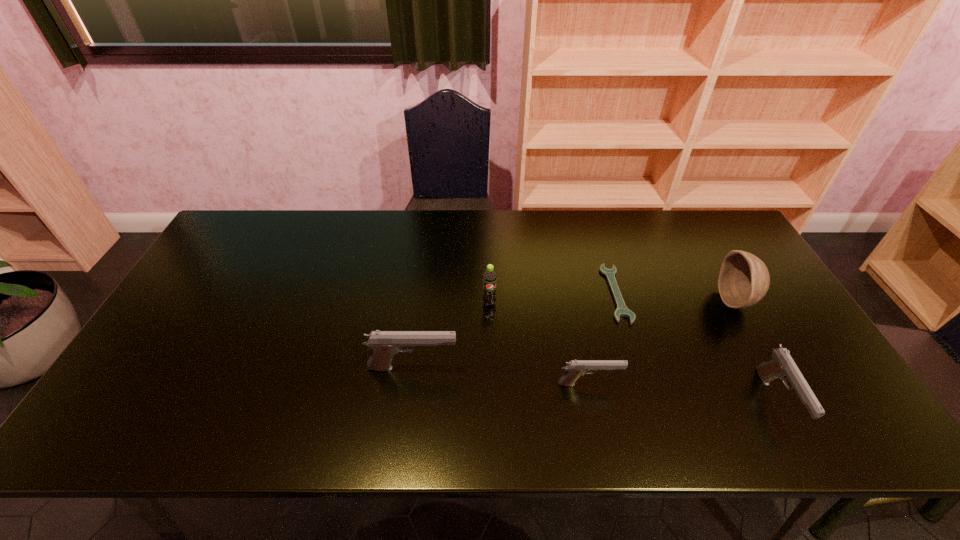
This screenshot has width=960, height=540. Find the location of `free region at the far right corner of the desktop`. free region at the far right corner of the desktop is located at coordinates (705, 224).

Locate an element on the screen. Image resolution: width=960 pixels, height=540 pixels. free space between the second shortest pistol and the leftmost object is located at coordinates (594, 384).

In order to click on free space between the rightmost pistol and the shortest object in this screenshot , I will do `click(696, 347)`.

You are a GUI agent. You are given a task and a screenshot of the screen. Output one action in this format:
    pyautogui.click(x=<x>, y=<y>)
    Task: Click on the vacant area that lies between the leftmost pistol and the shortest pistol
    The width and height of the screenshot is (960, 540).
    Given the screenshot: What is the action you would take?
    pyautogui.click(x=501, y=376)

The height and width of the screenshot is (540, 960). What are the coordinates of `vacant space that is in between the wrench and the leftmost object` in the screenshot? It's located at (515, 331).

Where is `vacant area that lies between the fourth tallest object and the shortest object`? vacant area that lies between the fourth tallest object and the shortest object is located at coordinates (696, 347).

Image resolution: width=960 pixels, height=540 pixels. In order to click on empty location between the rightmost pistol and the bowl in this screenshot , I will do `click(756, 351)`.

The image size is (960, 540). What are the coordinates of `empty location between the third object from left to right and the bowl` in the screenshot? It's located at (662, 342).

Identify the location of empty space that is in between the fifth tallest object and the soda. (540, 343).

Locate an element on the screen. This screenshot has height=540, width=960. vacant space in between the second shortest object and the leftmost pistol is located at coordinates (501, 376).